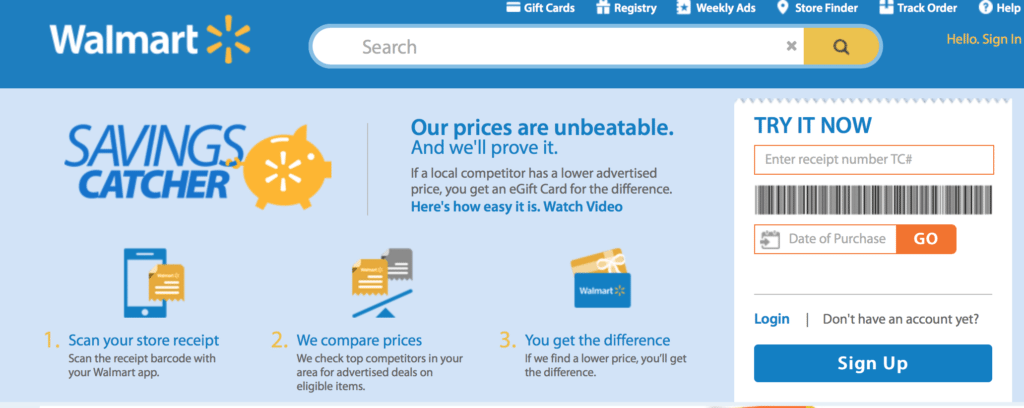
Where is `piggy bank`? The width and height of the screenshot is (1024, 408). piggy bank is located at coordinates (304, 173).